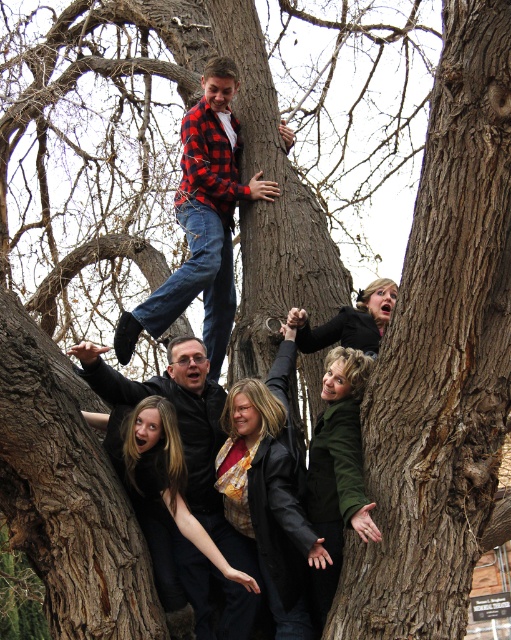
Question: Which point appears closest to the camera in this image?

Choices:
 (A) (223, 323)
 (B) (319, 454)
 (C) (199, 582)

Answer: (B)

Question: Is the position of plaid flannel shirt at center more distant than that of green matte jacket at lower center?

Choices:
 (A) yes
 (B) no

Answer: (A)

Question: Which of the following is the farthest from the observer?

Choices:
 (A) (357, 513)
 (B) (189, 230)
 (C) (167, 477)

Answer: (B)

Question: Is plaid flannel shirt at center closer to the viewer compared to green matte jacket at lower center?

Choices:
 (A) yes
 (B) no

Answer: (B)

Question: Which of the following is the closest to the observer?

Choices:
 (A) green matte jacket at lower center
 (B) plaid flannel shirt at center

Answer: (A)

Question: Considering the relative positions of red plaid shirt at upper center and green matte jacket at lower center in the image provided, where is red plaid shirt at upper center located with respect to green matte jacket at lower center?

Choices:
 (A) above
 (B) below

Answer: (A)